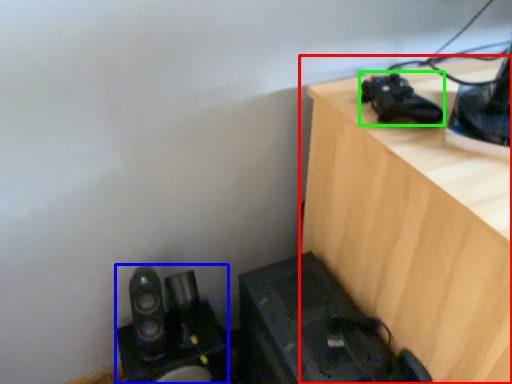
Question: Which object is the farthest from furniture (highlighted by a red box)? Choose among these: equipment (highlighted by a blue box) or shoe (highlighted by a green box).

Choices:
 (A) equipment
 (B) shoe

Answer: (A)